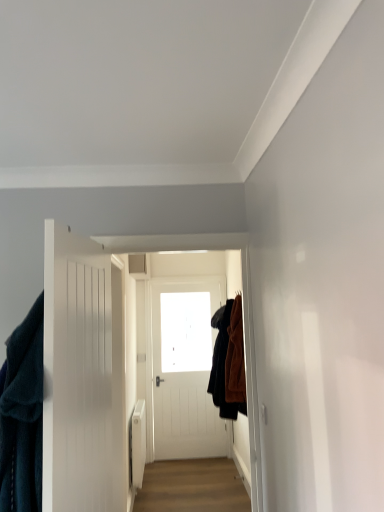
What is the approximate height of velvet brown coat at right, placed as the first clothing when sorted from back to front?

The height of velvet brown coat at right, placed as the first clothing when sorted from back to front, is 94.29 centimeters.

Measure the distance between velvety dark blue robe at left, placed as the 1th clothing when sorted from front to back, and camera.

They are 1.41 meters apart.

What do you see at coordinates (192, 487) in the screenshot? I see `light brown wood floor at center` at bounding box center [192, 487].

What is the approximate height of light brown wood floor at center?

light brown wood floor at center is 4.85 centimeters in height.

Identify the location of transparent glass window at center. This screenshot has height=512, width=384. (185, 332).

What do you see at coordinates (185, 332) in the screenshot? I see `transparent glass window at center` at bounding box center [185, 332].

Find the location of a particular element. white wooden door at left is located at coordinates (83, 376).

Where is `velvet brown coat at right, the 2th clothing positioned from the front`? The width and height of the screenshot is (384, 512). velvet brown coat at right, the 2th clothing positioned from the front is located at coordinates (229, 361).

Would you say velvet brown coat at right, placed as the 2th clothing when sorted from left to right, is to the left or to the right of white wooden door at left in the picture?

From the image, it's evident that velvet brown coat at right, placed as the 2th clothing when sorted from left to right, is to the right of white wooden door at left.

From the image's perspective, is velvet brown coat at right, positioned as the first clothing in right-to-left order, on white wooden door at left?

No, from the image's perspective, velvet brown coat at right, positioned as the first clothing in right-to-left order, is not over white wooden door at left.

Is point (239, 324) behind point (71, 420)?

Yes, point (239, 324) is behind point (71, 420).

Could white wooden door at left be considered to be inside light brown wood floor at center?

Actually, white wooden door at left is outside light brown wood floor at center.

Is point (154, 468) closer or farther from the camera than point (74, 509)?

Point (154, 468) is positioned farther from the camera compared to point (74, 509).

Would you consider light brown wood floor at center to be distant from white wooden door at left?

light brown wood floor at center is far away from white wooden door at left.

Is light brown wood floor at center to the left or to the right of white wooden door at left in the image?

light brown wood floor at center is to the right of white wooden door at left.

Measure the distance between transparent glass window at center and white wooden door at left.

The distance of transparent glass window at center from white wooden door at left is 3.06 meters.

From the image's perspective, is transparent glass window at center positioned above or below white wooden door at left?

transparent glass window at center is below white wooden door at left.

Considering the positions of point (165, 362) and point (109, 498), is point (165, 362) closer or farther from the camera than point (109, 498)?

Point (165, 362) appears to be farther away from the viewer than point (109, 498).

Which is correct: transparent glass window at center is inside white wooden door at left, or outside of it?

transparent glass window at center is not inside white wooden door at left, it's outside.

From the image's perspective, between white wooden door at left and transparent glass window at center, which one is located above?

From the image's view, white wooden door at left is above.

Could you tell me if white wooden door at left is facing transparent glass window at center?

No, white wooden door at left does not turn towards transparent glass window at center.

Identify the location of door in front of the transparent glass window at center. The image size is (384, 512). (83, 376).

From a real-world perspective, is white wooden door at left under transparent glass window at center?

Yes.

How many degrees apart are the facing directions of transparent glass window at center and light brown wood floor at center?

transparent glass window at center and light brown wood floor at center are facing 89.3 degrees away from each other.

The height and width of the screenshot is (512, 384). I want to click on alley on the right side of transparent glass window at center, so click(x=192, y=487).

Do you think transparent glass window at center is within light brown wood floor at center, or outside of it?

transparent glass window at center is outside light brown wood floor at center.

Does transparent glass window at center appear on the left side of light brown wood floor at center?

Indeed, transparent glass window at center is positioned on the left side of light brown wood floor at center.

Is white wooden door at left positioned with its back to velvet brown coat at right, the 2th clothing positioned from the front?

No, white wooden door at left's orientation is not away from velvet brown coat at right, the 2th clothing positioned from the front.

Based on the photo, would you consider white wooden door at left to be distant from velvet brown coat at right, positioned as the first clothing in right-to-left order?

Yes, white wooden door at left and velvet brown coat at right, positioned as the first clothing in right-to-left order, are quite far apart.

Is white wooden door at left thinner than velvet brown coat at right, the 2th clothing positioned from the front?

Correct, the width of white wooden door at left is less than that of velvet brown coat at right, the 2th clothing positioned from the front.

Considering the positions of point (120, 358) and point (238, 310), is point (120, 358) closer or farther from the camera than point (238, 310)?

Point (120, 358) appears to be closer to the viewer than point (238, 310).

Which of these two, velvet brown coat at right, placed as the first clothing when sorted from back to front, or velvety dark blue robe at left, placed as the 1th clothing when sorted from front to back, stands taller?

velvet brown coat at right, placed as the first clothing when sorted from back to front, is taller.

From a real-world perspective, does velvet brown coat at right, placed as the 2th clothing when sorted from left to right, stand above velvety dark blue robe at left, placed as the 2th clothing when sorted from right to left?

Incorrect, from a real-world perspective, velvet brown coat at right, placed as the 2th clothing when sorted from left to right, is lower than velvety dark blue robe at left, placed as the 2th clothing when sorted from right to left.

Is velvet brown coat at right, the 2th clothing positioned from the front, far from velvety dark blue robe at left, the first clothing positioned from the left?

velvet brown coat at right, the 2th clothing positioned from the front, is positioned a significant distance from velvety dark blue robe at left, the first clothing positioned from the left.

Identify the location of door above the velvet brown coat at right, the 2th clothing positioned from the front (from the image's perspective). The height and width of the screenshot is (512, 384). (83, 376).

Identify the location of alley below the white wooden door at left (from a real-world perspective). The image size is (384, 512). (192, 487).

Which object lies nearer to the anchor point velvet brown coat at right, positioned as the first clothing in right-to-left order, velvety dark blue robe at left, the first clothing positioned from the left, or white wooden door at left?

Among the two, white wooden door at left is located nearer to velvet brown coat at right, positioned as the first clothing in right-to-left order.

Estimate the real-world distances between objects in this image. Which object is further from white wooden door at left, velvety dark blue robe at left, placed as the 1th clothing when sorted from front to back, or light brown wood floor at center?

light brown wood floor at center is further to white wooden door at left.

Considering their positions, is light brown wood floor at center positioned closer to velvet brown coat at right, positioned as the first clothing in right-to-left order, than transparent glass window at center?

light brown wood floor at center.

In the scene shown: Considering their positions, is light brown wood floor at center positioned further to transparent glass window at center than velvet brown coat at right, placed as the 2th clothing when sorted from left to right?

Based on the image, velvet brown coat at right, placed as the 2th clothing when sorted from left to right, appears to be further to transparent glass window at center.

Based on their spatial positions, is velvet brown coat at right, placed as the first clothing when sorted from back to front, or light brown wood floor at center further from transparent glass window at center?

The object further to transparent glass window at center is velvet brown coat at right, placed as the first clothing when sorted from back to front.

Estimate the real-world distances between objects in this image. Which object is closer to velvet brown coat at right, placed as the 2th clothing when sorted from left to right, velvety dark blue robe at left, placed as the 2th clothing when sorted from right to left, or transparent glass window at center?

transparent glass window at center lies closer to velvet brown coat at right, placed as the 2th clothing when sorted from left to right, than the other object.

When comparing their distances from velvet brown coat at right, positioned as the first clothing in right-to-left order, does transparent glass window at center or velvety dark blue robe at left, the 2th clothing when ordered from back to front, seem closer?

transparent glass window at center is closer to velvet brown coat at right, positioned as the first clothing in right-to-left order.

Based on their spatial positions, is transparent glass window at center or velvety dark blue robe at left, the first clothing positioned from the left, further from white wooden door at left?

The object further to white wooden door at left is transparent glass window at center.

The height and width of the screenshot is (512, 384). I want to click on clothing between white wooden door at left and velvet brown coat at right, placed as the first clothing when sorted from back to front, along the z-axis, so click(x=22, y=416).

Where is `alley located between velvet brown coat at right, placed as the first clothing when sorted from back to front, and transparent glass window at center in the depth direction`? The image size is (384, 512). alley located between velvet brown coat at right, placed as the first clothing when sorted from back to front, and transparent glass window at center in the depth direction is located at coordinates (192, 487).

Where is `clothing located between velvety dark blue robe at left, the first clothing positioned from the left, and transparent glass window at center in the depth direction`? This screenshot has width=384, height=512. clothing located between velvety dark blue robe at left, the first clothing positioned from the left, and transparent glass window at center in the depth direction is located at coordinates (229, 361).

This screenshot has width=384, height=512. In order to click on alley positioned between velvety dark blue robe at left, the first clothing positioned from the left, and transparent glass window at center from near to far in this screenshot , I will do `click(192, 487)`.